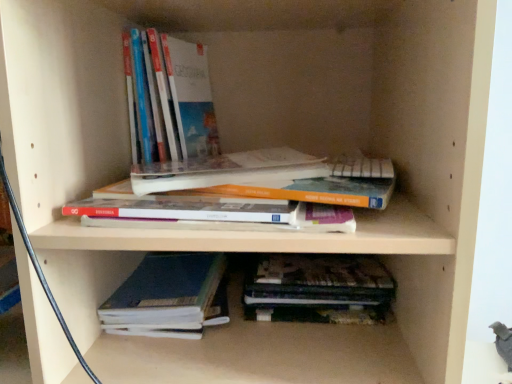
Question: From the image's perspective, is dark brown leather book at lower center, which is counted as the second book, starting from the bottom, located above or below hardcover book at center, positioned as the 3th book in bottom-to-top order?

Choices:
 (A) below
 (B) above

Answer: (A)

Question: Is dark brown leather book at lower center, which is counted as the second book, starting from the bottom, wider or thinner than hardcover book at center, positioned as the 3th book in bottom-to-top order?

Choices:
 (A) thin
 (B) wide

Answer: (A)

Question: Estimate the real-world distances between objects in this image. Which object is farther from the dark brown leather book at lower center, which is counted as the second book, starting from the bottom?

Choices:
 (A) hardcover book at center, the 2th book when ordered from top to bottom
 (B) hardcover book at upper left, which appears as the 4th book when ordered from the bottom
 (C) dark blue hardcover book at lower center, the fourth book from the top

Answer: (B)

Question: Which is nearer to the dark blue hardcover book at lower center, marked as the 1th book in a bottom-to-top arrangement?

Choices:
 (A) dark brown leather book at lower center, which is counted as the second book, starting from the bottom
 (B) hardcover book at center, positioned as the 3th book in bottom-to-top order
 (C) hardcover book at upper left, which appears as the 4th book when ordered from the bottom

Answer: (A)